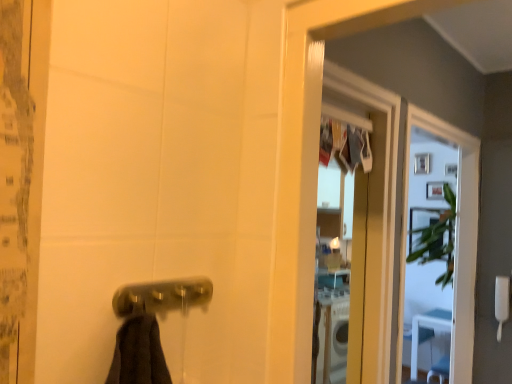
Question: Can you confirm if polished brass door handle at lower center is shorter than clear glass screen door at upper right?

Choices:
 (A) no
 (B) yes

Answer: (B)

Question: Is polished brass door handle at lower center further to camera compared to clear glass screen door at upper right?

Choices:
 (A) no
 (B) yes

Answer: (A)

Question: From a real-world perspective, is polished brass door handle at lower center below clear glass screen door at upper right?

Choices:
 (A) no
 (B) yes

Answer: (A)

Question: Is polished brass door handle at lower center positioned beyond the bounds of clear glass screen door at upper right?

Choices:
 (A) no
 (B) yes

Answer: (B)

Question: Are polished brass door handle at lower center and clear glass screen door at upper right located far from each other?

Choices:
 (A) yes
 (B) no

Answer: (A)

Question: Is polished brass door handle at lower center facing away from clear glass screen door at upper right?

Choices:
 (A) no
 (B) yes

Answer: (A)

Question: Can you confirm if polished brass door handle at lower center is shorter than white plastic towel bar at lower left?

Choices:
 (A) yes
 (B) no

Answer: (A)

Question: Can you confirm if polished brass door handle at lower center is taller than white plastic towel bar at lower left?

Choices:
 (A) no
 (B) yes

Answer: (A)

Question: Is polished brass door handle at lower center aimed at white plastic towel bar at lower left?

Choices:
 (A) yes
 (B) no

Answer: (B)

Question: From a real-world perspective, does polished brass door handle at lower center stand above white plastic towel bar at lower left?

Choices:
 (A) yes
 (B) no

Answer: (A)

Question: Is polished brass door handle at lower center looking in the opposite direction of white plastic towel bar at lower left?

Choices:
 (A) yes
 (B) no

Answer: (B)

Question: From a real-world perspective, is polished brass door handle at lower center below white plastic towel bar at lower left?

Choices:
 (A) no
 (B) yes

Answer: (A)

Question: Is clear glass screen door at upper right thinner than polished brass door handle at lower center?

Choices:
 (A) yes
 (B) no

Answer: (B)